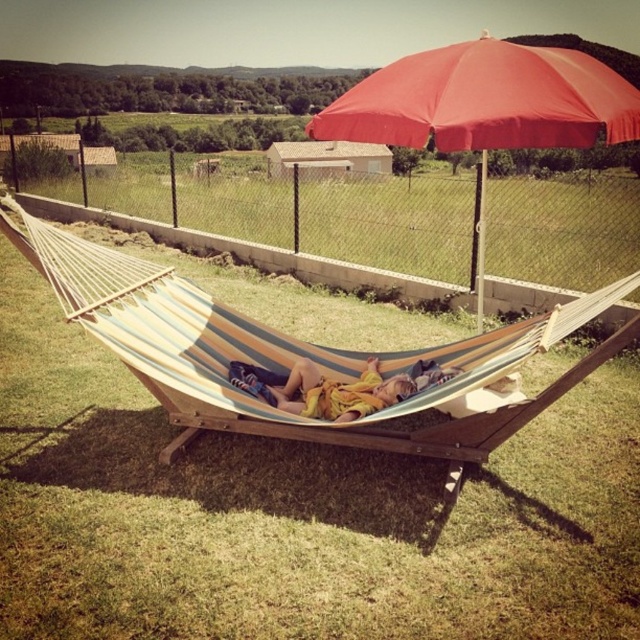
Question: Does red fabric umbrella at upper center have a greater width compared to yellow fabric at center?

Choices:
 (A) yes
 (B) no

Answer: (A)

Question: Which point is farther to the camera?

Choices:
 (A) (397, 369)
 (B) (534, 74)

Answer: (A)

Question: Does striped fabric hammock at center have a smaller size compared to yellow fabric at center?

Choices:
 (A) yes
 (B) no

Answer: (B)

Question: Based on their relative distances, which object is farther from the red fabric umbrella at upper center?

Choices:
 (A) striped fabric hammock at center
 (B) yellow fabric at center

Answer: (B)

Question: Is striped fabric hammock at center smaller than yellow fabric at center?

Choices:
 (A) no
 (B) yes

Answer: (A)

Question: Which point is closer to the camera taking this photo?

Choices:
 (A) (513, 83)
 (B) (244, 364)

Answer: (A)